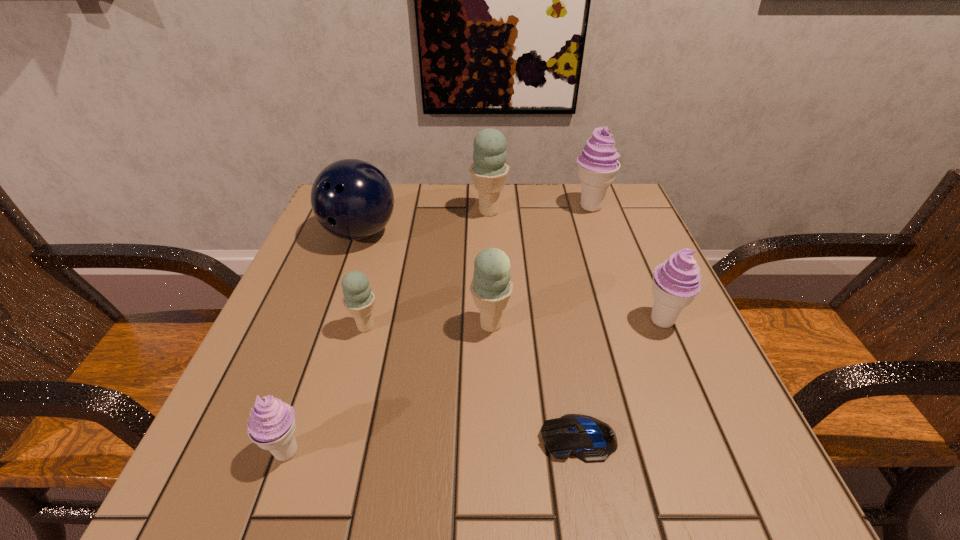
In the image, there is a desktop. Find the location of `vacant region at the left edge`. vacant region at the left edge is located at coordinates (299, 374).

You are a GUI agent. You are given a task and a screenshot of the screen. Output one action in this format:
    pyautogui.click(x=<x>, y=<y>)
    Task: Click on the vacant area at the right edge
    
    Given the screenshot: What is the action you would take?
    pyautogui.click(x=668, y=417)

Locate an element on the screen. The width and height of the screenshot is (960, 540). free space at the far right corner is located at coordinates (579, 196).

The height and width of the screenshot is (540, 960). What are the coordinates of `blank region between the blue bowling ball and the farthest purple icecream` in the screenshot? It's located at (475, 220).

Locate an element on the screen. free space between the fifth icecream from right to left and the second smallest blue ice cream is located at coordinates (428, 326).

Image resolution: width=960 pixels, height=540 pixels. What are the coordinates of `free space between the shortest object and the nearest icecream` in the screenshot? It's located at (433, 445).

Find the location of `blank region between the biggest purple icecream and the third object from right to left`. blank region between the biggest purple icecream and the third object from right to left is located at coordinates (584, 323).

At what (x,y) coordinates should I click in order to perform the action: click on free space between the smallest purple icecream and the bowling ball. Please return your answer as a coordinate pair (x, y). The height and width of the screenshot is (540, 960). Looking at the image, I should click on pos(324,342).

At what (x,y) coordinates should I click in order to perform the action: click on free space between the shortest object and the farthest blue ice cream. Please return your answer as a coordinate pair (x, y). The image size is (960, 540). Looking at the image, I should click on (534, 325).

Find the location of a particular element. The image size is (960, 540). vacant area that lies between the fifth icecream from right to left and the nearest icecream is located at coordinates (326, 389).